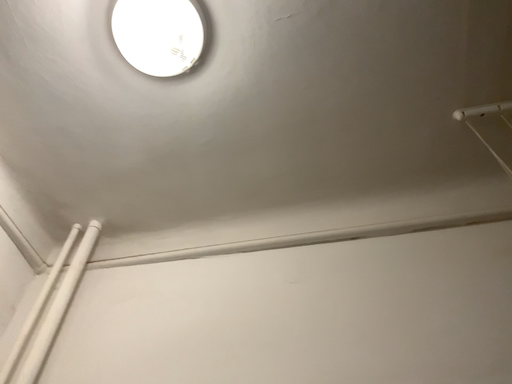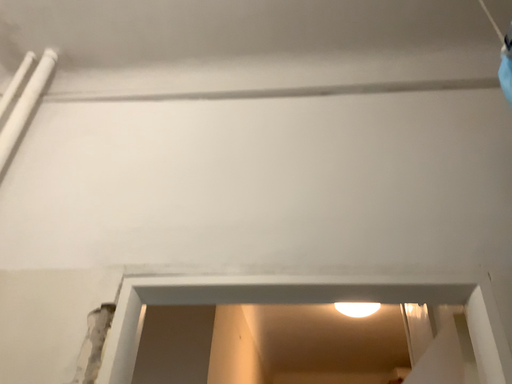
Question: Which way did the camera rotate in the video?

Choices:
 (A) rotated downward
 (B) rotated upward

Answer: (A)